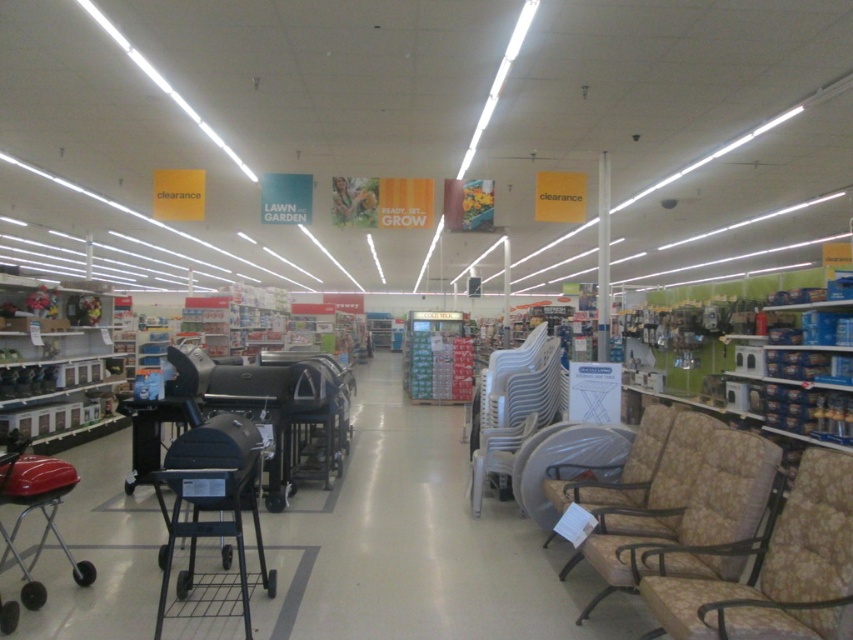
You are a customer in the store and want to sit down to rest. You see the floral fabric armchair at lower right and the beige fabric armchair at right. Which one is smaller and more suitable for a petite person?

The floral fabric armchair at lower right is smaller than the beige fabric armchair at right, making it more suitable for a petite person.

You are standing in the center of the aisle in the retail store. You need to sit down to rest. Where is the beige fabric armchair at right located?

The beige fabric armchair at right is located at point [694,520] in the retail store.